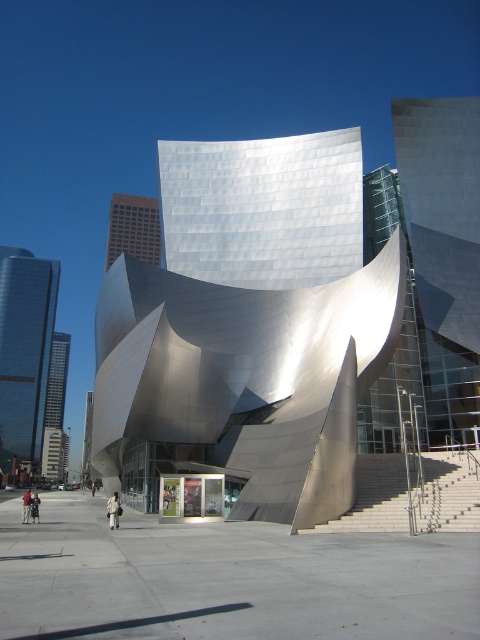
Question: Which point is closer to the camera?

Choices:
 (A) light brown leather jacket at center
 (B) light beige fabric bag at center
 (C) shiny glass skyscraper at left
 (D) dark gray fabric jacket at lower left

Answer: (B)

Question: Based on their relative distances, which object is farther from the light brown leather jacket at center?

Choices:
 (A) dark gray fabric jacket at lower left
 (B) shiny glass skyscraper at left

Answer: (B)

Question: Is light brown leather jacket at center to the right of dark gray fabric jacket at lower left from the viewer's perspective?

Choices:
 (A) yes
 (B) no

Answer: (B)

Question: Can you confirm if light beige fabric bag at center is positioned above dark gray fabric jacket at lower left?

Choices:
 (A) no
 (B) yes

Answer: (A)

Question: Which of the following is the farthest from the observer?

Choices:
 (A) (108, 516)
 (B) (36, 508)
 (C) (29, 504)

Answer: (A)

Question: In this image, where is light beige fabric bag at center located relative to light brown leather jacket at center?

Choices:
 (A) left
 (B) right

Answer: (B)